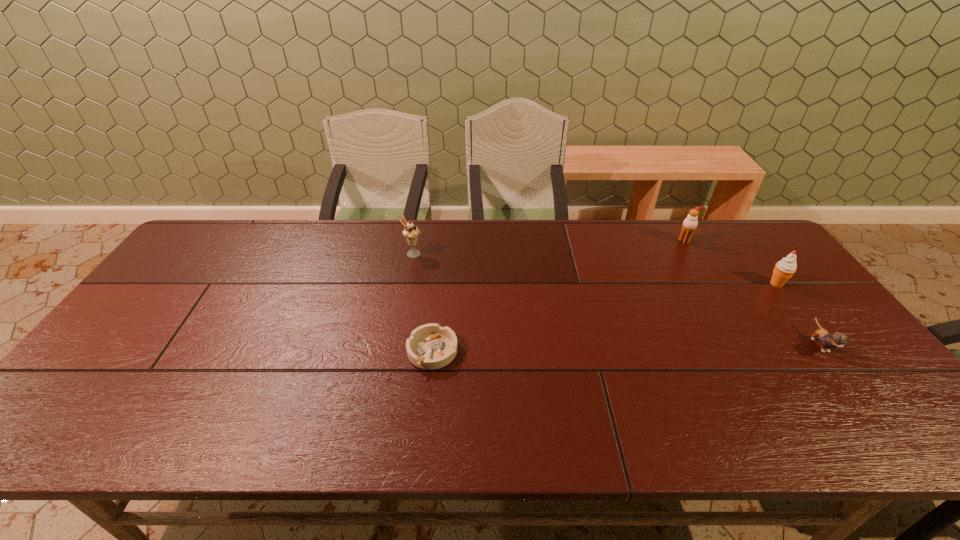
Where is `free area in between the rightmost icecream and the leftmost icecream`? Image resolution: width=960 pixels, height=540 pixels. free area in between the rightmost icecream and the leftmost icecream is located at coordinates (594, 269).

I want to click on empty space that is in between the kitten and the fourth object from right to left, so click(626, 348).

Locate an element on the screen. This screenshot has height=540, width=960. empty location between the ashtray and the third object from right to left is located at coordinates (559, 296).

You are a GUI agent. You are given a task and a screenshot of the screen. Output one action in this format:
    pyautogui.click(x=<x>, y=<y>)
    Task: Click on the free area in between the nearest icecream and the leftmost icecream
    
    Given the screenshot: What is the action you would take?
    pyautogui.click(x=594, y=269)

Where is `unoccupied position between the kitten and the second icecream from right to left`? The image size is (960, 540). unoccupied position between the kitten and the second icecream from right to left is located at coordinates (752, 293).

Identify the location of vacant point located between the fourth object from right to left and the nearest icecream. (605, 318).

In order to click on vacant point located between the fourth nearest object and the second shortest object in this screenshot , I will do `click(616, 299)`.

Locate an element on the screen. Image resolution: width=960 pixels, height=540 pixels. vacant region between the farthest object and the fourth nearest object is located at coordinates (548, 247).

The height and width of the screenshot is (540, 960). I want to click on free space between the rightmost icecream and the kitten, so (x=798, y=314).

The height and width of the screenshot is (540, 960). I want to click on vacant space that's between the shortest object and the nearest icecream, so (605, 318).